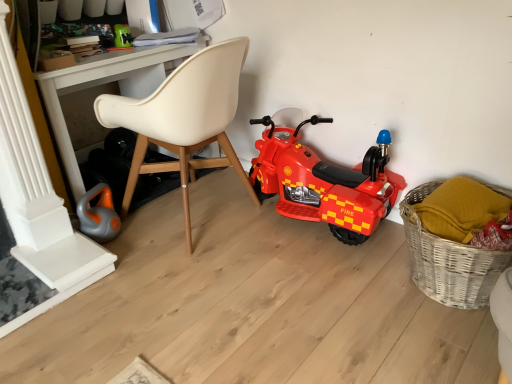
The image size is (512, 384). I want to click on vacant space underneath beige leather chair at center (from a real-world perspective), so click(x=205, y=218).